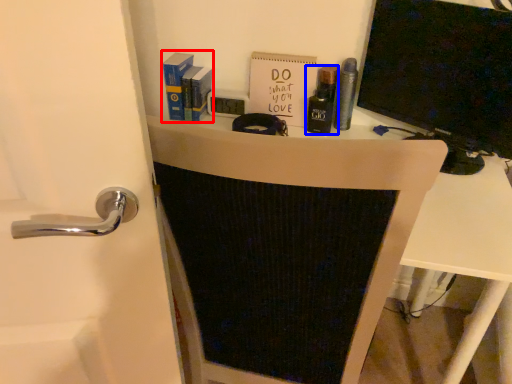
Question: Which point is closer to the camera, book (highlighted by a red box) or toiletry (highlighted by a blue box)?

Choices:
 (A) book
 (B) toiletry

Answer: (B)